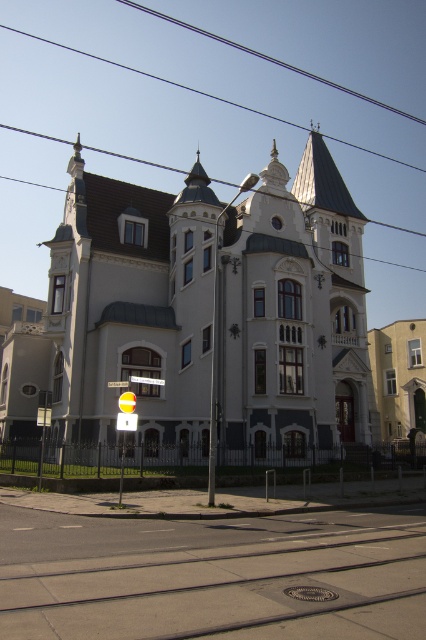
You are a delivery person trying to attach a package to the metallic wire at upper center. The white plastic street sign at center is in the way. Can you move the sign to make space?

The metallic wire at upper center has a larger size compared to the white plastic street sign at center. Since the wire is larger, you might need to adjust the sign to a position where it doesn not block the wire to attach the package.

Looking at this image, you are standing in front of the grand building and notice a specific point marked on the image. What object is located at the coordinates point (132, 157)?

The point (132, 157) marks the location of the metallic wire at upper center.

You are a delivery person trying to hang a new sign on the building. The new sign is 1.2 meters wide. The current metallic wire at upper center and the white plastic street sign at center are already present. Can the new sign fit between them without overlapping?

The metallic wire at upper center might be wider than the white plastic street sign at center. Since the new sign is 1.2 meters wide, it depends on the actual width of the metallic wire at upper center. If the metallic wire at upper center is indeed wider than the sign, there might not be enough space. However, if it is narrower, there could be space. Without exact measurements, it is uncertain.